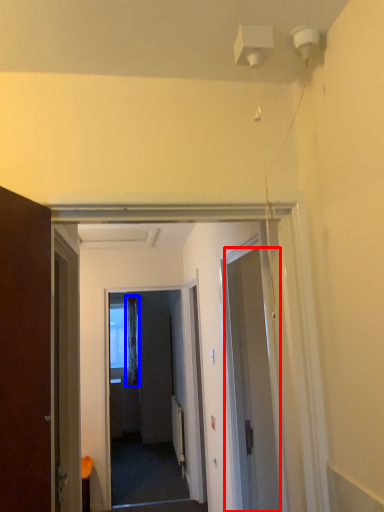
Question: Which of the following is the farthest to the observer, door (highlighted by a red box) or curtain (highlighted by a blue box)?

Choices:
 (A) door
 (B) curtain

Answer: (B)